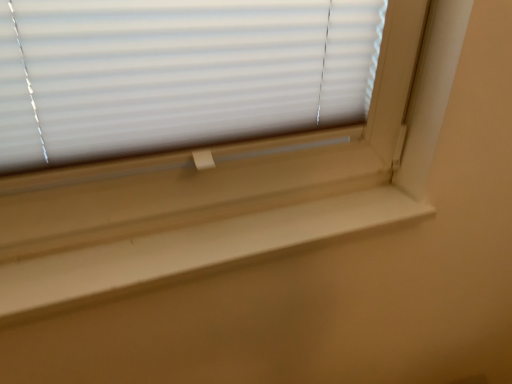
Question: Is white matte blinds at upper center inside white smooth window sill at center?

Choices:
 (A) no
 (B) yes

Answer: (A)

Question: Does white smooth window sill at center have a larger size compared to white matte blinds at upper center?

Choices:
 (A) yes
 (B) no

Answer: (A)

Question: From a real-world perspective, is white smooth window sill at center beneath white matte blinds at upper center?

Choices:
 (A) yes
 (B) no

Answer: (A)

Question: Can you confirm if white smooth window sill at center is thinner than white matte blinds at upper center?

Choices:
 (A) yes
 (B) no

Answer: (B)

Question: From a real-world perspective, does white smooth window sill at center stand above white matte blinds at upper center?

Choices:
 (A) no
 (B) yes

Answer: (A)

Question: Is the depth of white smooth window sill at center greater than that of white matte blinds at upper center?

Choices:
 (A) no
 (B) yes

Answer: (B)

Question: Is white matte blinds at upper center looking in the opposite direction of white smooth window sill at center?

Choices:
 (A) no
 (B) yes

Answer: (A)

Question: From the image's perspective, is white matte blinds at upper center under white smooth window sill at center?

Choices:
 (A) yes
 (B) no

Answer: (B)

Question: Considering the relative positions of white matte blinds at upper center and white smooth window sill at center in the image provided, is white matte blinds at upper center behind white smooth window sill at center?

Choices:
 (A) yes
 (B) no

Answer: (B)

Question: Can you confirm if white matte blinds at upper center is wider than white smooth window sill at center?

Choices:
 (A) no
 (B) yes

Answer: (A)

Question: Does white matte blinds at upper center have a larger size compared to white smooth window sill at center?

Choices:
 (A) yes
 (B) no

Answer: (B)

Question: From a real-world perspective, is white matte blinds at upper center physically above white smooth window sill at center?

Choices:
 (A) no
 (B) yes

Answer: (B)

Question: In terms of size, does white matte blinds at upper center appear bigger or smaller than white smooth window sill at center?

Choices:
 (A) small
 (B) big

Answer: (A)